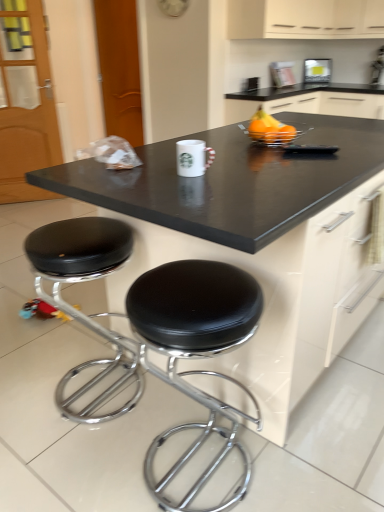
Question: Is black leather stool at lower left, positioned as the first stool in left-to-right order, placed right next to matte plastic light at upper center?

Choices:
 (A) yes
 (B) no

Answer: (B)

Question: From the image's perspective, is black leather stool at lower left, which is the 2th stool in right-to-left order, beneath matte plastic light at upper center?

Choices:
 (A) yes
 (B) no

Answer: (A)

Question: Can you confirm if black leather stool at lower left, positioned as the first stool in left-to-right order, is wider than matte plastic light at upper center?

Choices:
 (A) yes
 (B) no

Answer: (A)

Question: Is black leather stool at lower left, positioned as the first stool in left-to-right order, closer to camera compared to matte plastic light at upper center?

Choices:
 (A) yes
 (B) no

Answer: (A)

Question: Does black leather stool at lower left, positioned as the first stool in left-to-right order, appear on the right side of matte plastic light at upper center?

Choices:
 (A) no
 (B) yes

Answer: (A)

Question: Does point (357, 15) appear closer or farther from the camera than point (288, 135)?

Choices:
 (A) closer
 (B) farther

Answer: (B)

Question: From the image's perspective, is cream matte cabinet at upper center located above or below shiny orange fruit at upper right?

Choices:
 (A) below
 (B) above

Answer: (B)

Question: Based on their sizes in the image, would you say cream matte cabinet at upper center is bigger or smaller than shiny orange fruit at upper right?

Choices:
 (A) small
 (B) big

Answer: (B)

Question: Relative to shiny orange fruit at upper right, is cream matte cabinet at upper center in front or behind?

Choices:
 (A) behind
 (B) front

Answer: (A)

Question: In the image, is shiny orange fruit at upper right positioned in front of or behind black laminate countertop at center?

Choices:
 (A) front
 (B) behind

Answer: (B)

Question: Based on their sizes in the image, would you say shiny orange fruit at upper right is bigger or smaller than black laminate countertop at center?

Choices:
 (A) small
 (B) big

Answer: (A)

Question: Visually, is shiny orange fruit at upper right positioned to the left or to the right of black laminate countertop at center?

Choices:
 (A) left
 (B) right

Answer: (A)

Question: From the image's perspective, is shiny orange fruit at upper right positioned above or below black laminate countertop at center?

Choices:
 (A) below
 (B) above

Answer: (B)

Question: Considering their positions, is matte plastic light at upper center located in front of or behind cream matte cabinet at upper center?

Choices:
 (A) behind
 (B) front

Answer: (A)

Question: Based on their positions, is matte plastic light at upper center located to the left or right of cream matte cabinet at upper center?

Choices:
 (A) left
 (B) right

Answer: (B)